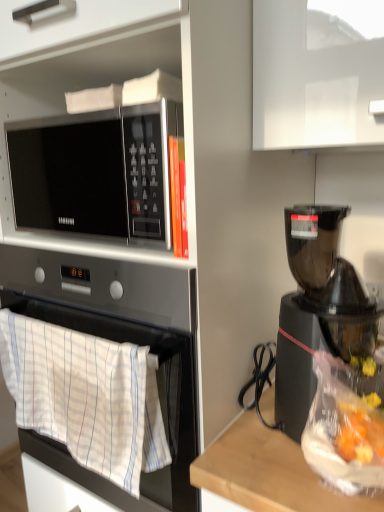
The width and height of the screenshot is (384, 512). I want to click on blank space situated above white cotton towel at lower left (from a real-world perspective), so 71,330.